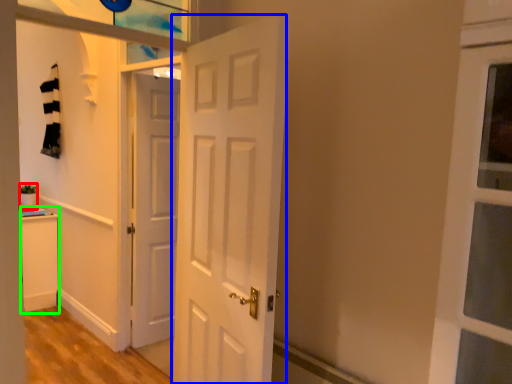
Question: Which object is the farthest from houseplant (highlighted by a red box)? Choose among these: door (highlighted by a blue box) or cabinetry (highlighted by a green box).

Choices:
 (A) door
 (B) cabinetry

Answer: (A)